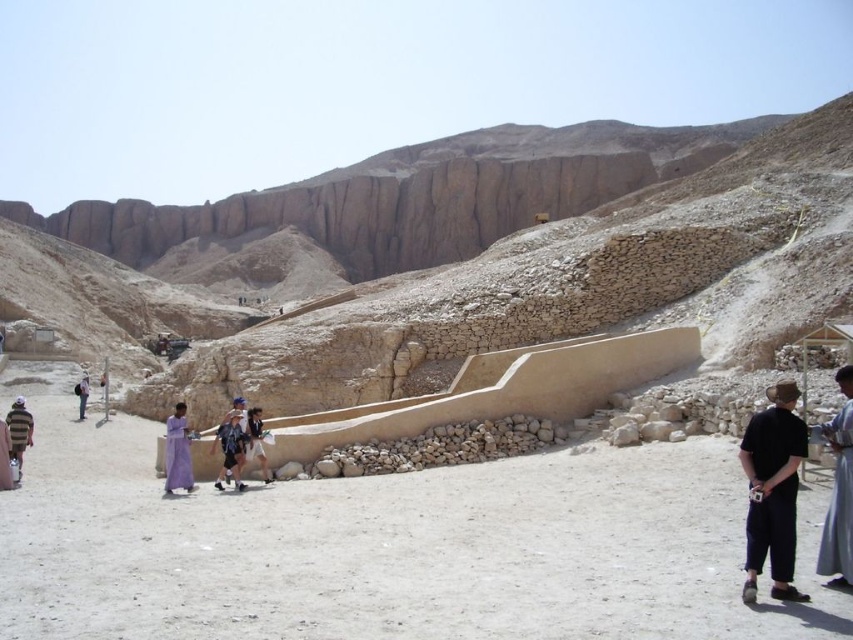
Find the location of `gray cotton dress at lower right`. gray cotton dress at lower right is located at coordinates (839, 492).

Measure the distance from purple fabric dress at lower left to dark blue jeans at center.

purple fabric dress at lower left and dark blue jeans at center are 3.55 meters apart.

Which of these two, purple fabric dress at lower left or dark blue jeans at center, stands taller?

With more height is purple fabric dress at lower left.

Is point (177, 483) positioned before point (227, 413)?

Yes, it is.

The image size is (853, 640). I want to click on purple fabric dress at lower left, so (x=177, y=452).

Is purple fabric dress at lower left to the right of striped cotton shirt at left from the viewer's perspective?

Correct, you'll find purple fabric dress at lower left to the right of striped cotton shirt at left.

Does point (180, 401) lie in front of point (4, 419)?

That is False.

Identify the location of purple fabric dress at lower left. (177, 452).